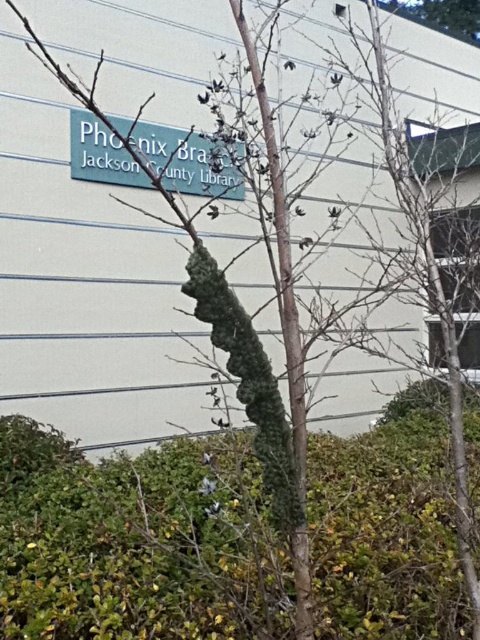
Is green leafy hedge at center below teal matte sign at upper center?

Correct, green leafy hedge at center is located below teal matte sign at upper center.

Does green leafy hedge at center appear on the right side of teal matte sign at upper center?

Correct, you'll find green leafy hedge at center to the right of teal matte sign at upper center.

Who is more distant from viewer, (450, 620) or (164, 131)?

The point (164, 131) is behind.

The width and height of the screenshot is (480, 640). Identify the location of green leafy hedge at center. (128, 554).